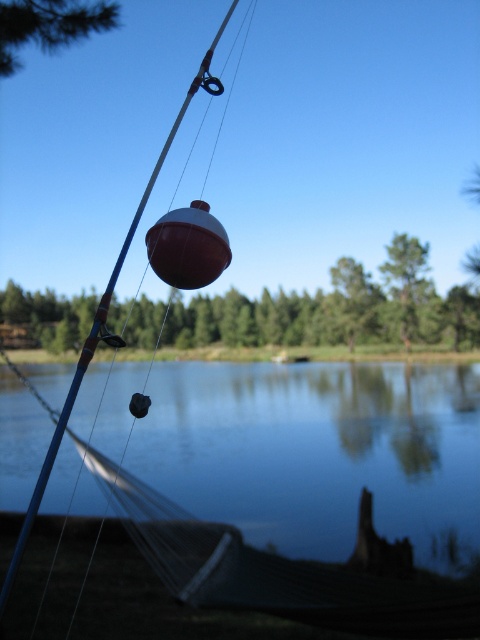
Between point (49, 12) and point (420, 307), which one is positioned behind?

Point (420, 307)

Can you confirm if green textured pine tree at upper left is smaller than green matte tree at upper center?

Indeed, green textured pine tree at upper left has a smaller size compared to green matte tree at upper center.

Describe the element at coordinates (48, 24) in the screenshot. I see `green textured pine tree at upper left` at that location.

The height and width of the screenshot is (640, 480). Identify the location of green textured pine tree at upper left. (48, 24).

Describe the element at coordinates (319, 452) in the screenshot. The height and width of the screenshot is (640, 480). I see `smooth blue water at center` at that location.

Between smooth blue water at center and green textured pine tree at upper left, which one is positioned higher?

green textured pine tree at upper left is above.

Describe the element at coordinates (319, 452) in the screenshot. This screenshot has width=480, height=640. I see `smooth blue water at center` at that location.

Locate an element on the screen. smooth blue water at center is located at coordinates (319, 452).

Who is taller, matte blue fishing pole at center or green matte tree at upper center?

matte blue fishing pole at center is taller.

Who is more forward, (48,468) or (396,268)?

Point (48,468)

Is point (39, 496) positioned before point (408, 317)?

Yes, it is.

You are a GUI agent. You are given a task and a screenshot of the screen. Output one action in this format:
    pyautogui.click(x=<x>, y=<y>)
    Task: Click on the matte blue fishing pole at center
    Image resolution: width=480 pixels, height=640 pixels.
    Given the screenshot: What is the action you would take?
    pyautogui.click(x=104, y=320)